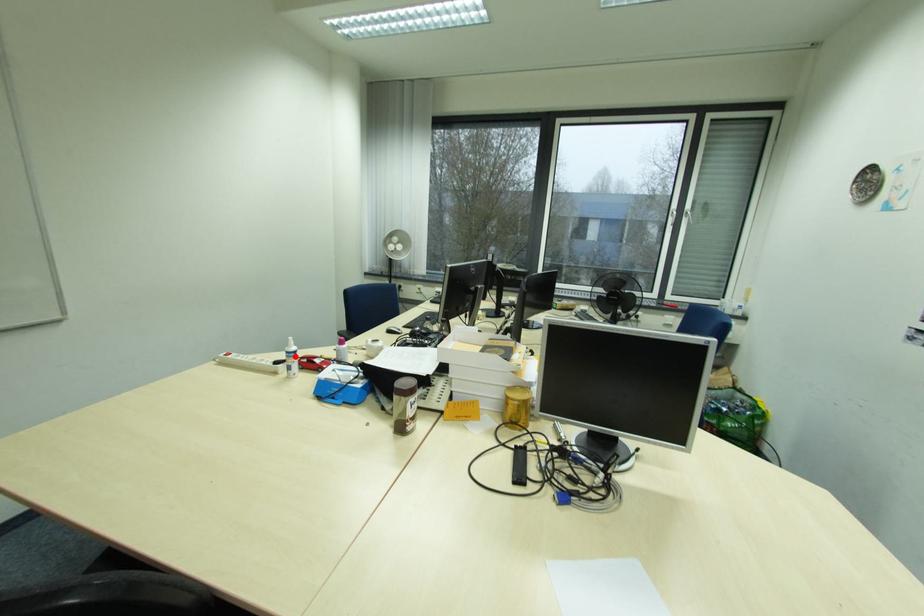
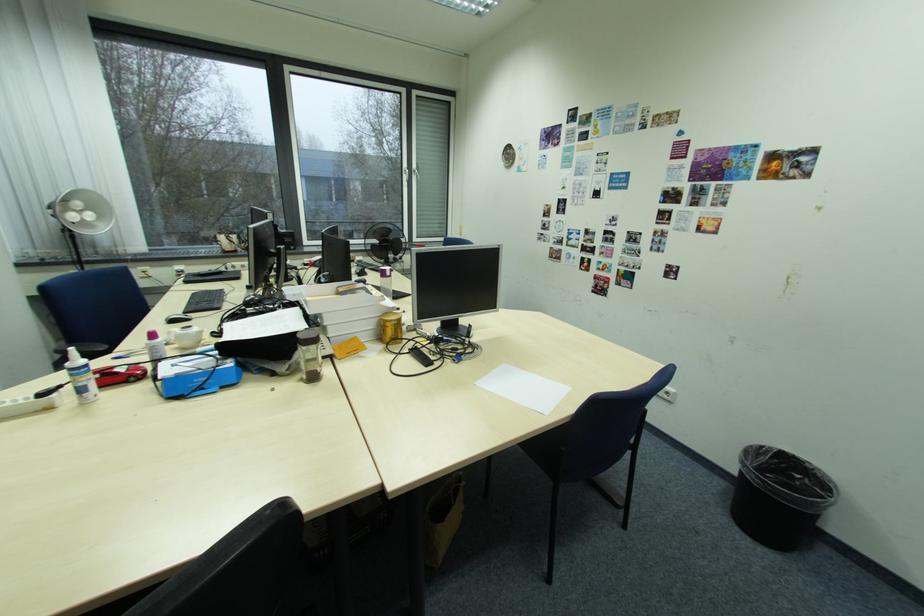
Locate, in the second image, the point that corresponds to the highlighted location in the first image.

(80, 376)